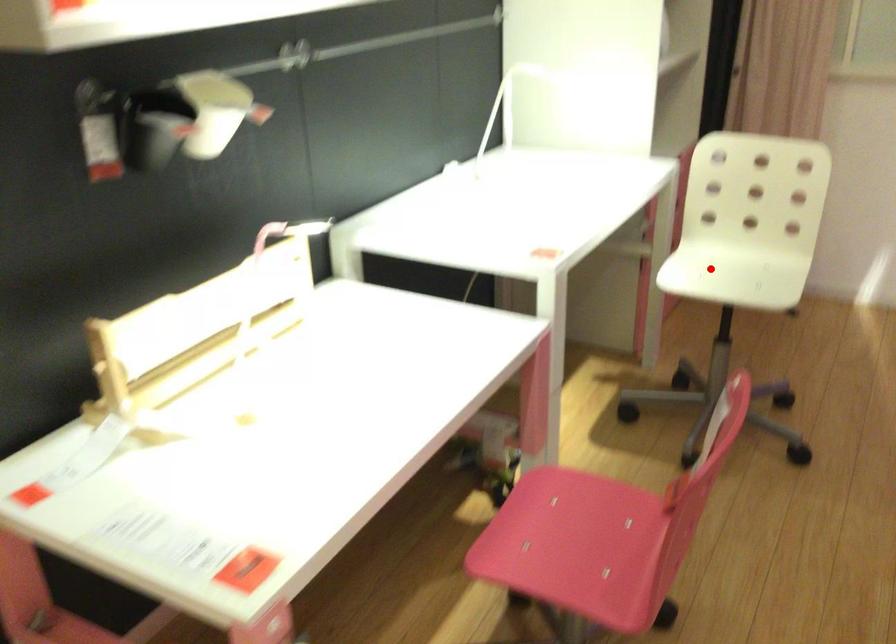
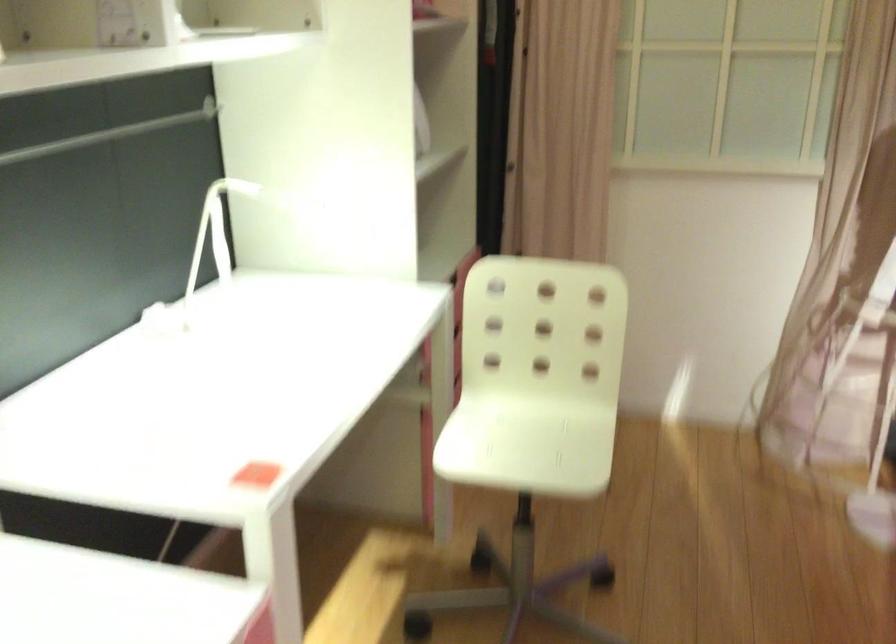
Where in the second image is the point corresponding to the highlighted location from the first image?

(495, 431)